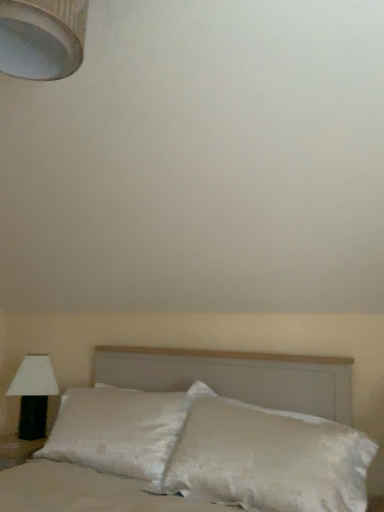
Question: Are white satin pillow at center and white textured lampshade at upper left, the second lamp positioned from the bottom, making contact?

Choices:
 (A) yes
 (B) no

Answer: (B)

Question: From a real-world perspective, is white satin pillow at center physically below white textured lampshade at upper left, which is counted as the 2th lamp, starting from the back?

Choices:
 (A) no
 (B) yes

Answer: (B)

Question: From the image's perspective, is white satin pillow at center under white textured lampshade at upper left, acting as the second lamp starting from the left?

Choices:
 (A) no
 (B) yes

Answer: (B)

Question: Considering the relative sizes of white satin pillow at center and white textured lampshade at upper left, positioned as the 1th lamp in front-to-back order, in the image provided, is white satin pillow at center taller than white textured lampshade at upper left, positioned as the 1th lamp in front-to-back order,?

Choices:
 (A) no
 (B) yes

Answer: (B)

Question: Is white satin pillow at center closer to the viewer compared to white textured lampshade at upper left, acting as the second lamp starting from the left?

Choices:
 (A) no
 (B) yes

Answer: (A)

Question: Is white satin pillow at center bigger or smaller than black fabric lamp at left, which is the second lamp in top-to-bottom order?

Choices:
 (A) small
 (B) big

Answer: (B)

Question: In the image, is white satin pillow at center positioned in front of or behind black fabric lamp at left, which is the second lamp in top-to-bottom order?

Choices:
 (A) behind
 (B) front

Answer: (B)

Question: From the image's perspective, is white satin pillow at center above or below black fabric lamp at left, which is the first lamp in left-to-right order?

Choices:
 (A) above
 (B) below

Answer: (A)

Question: Which is correct: white satin pillow at center is inside black fabric lamp at left, which is the 1th lamp in back-to-front order, or outside of it?

Choices:
 (A) inside
 (B) outside

Answer: (B)

Question: In the image, is white satin pillow at center on the left side or the right side of white textured lampshade at upper left, the second lamp positioned from the bottom?

Choices:
 (A) left
 (B) right

Answer: (B)

Question: From a real-world perspective, is white satin pillow at center physically located above or below white textured lampshade at upper left, the second lamp positioned from the bottom?

Choices:
 (A) below
 (B) above

Answer: (A)

Question: Is white satin pillow at center wider or thinner than white textured lampshade at upper left, acting as the second lamp starting from the left?

Choices:
 (A) thin
 (B) wide

Answer: (B)

Question: Would you say white satin pillow at center is inside or outside white textured lampshade at upper left, which is the first lamp in top-to-bottom order?

Choices:
 (A) inside
 (B) outside

Answer: (B)

Question: From a real-world perspective, relative to white satin pillow at center, is white satin bed at center vertically above or below?

Choices:
 (A) above
 (B) below

Answer: (A)

Question: In the image, is white satin bed at center on the left side or the right side of white satin pillow at center?

Choices:
 (A) left
 (B) right

Answer: (B)